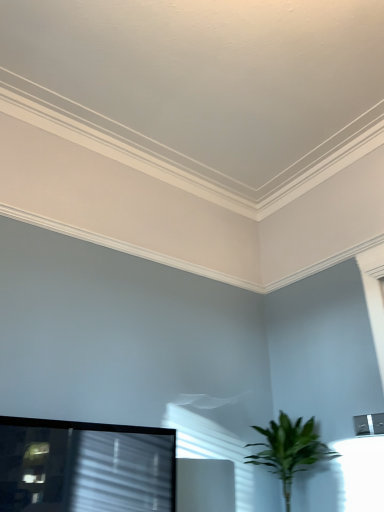
This screenshot has width=384, height=512. I want to click on green leafy plant at lower right, so click(289, 450).

The width and height of the screenshot is (384, 512). What do you see at coordinates (289, 450) in the screenshot?
I see `green leafy plant at lower right` at bounding box center [289, 450].

In order to face green leafy plant at lower right, should I rotate leftwards or rightwards?

Turn right by 12.607 degrees to look at green leafy plant at lower right.

Where is `green leafy plant at lower right`? The image size is (384, 512). green leafy plant at lower right is located at coordinates point(289,450).